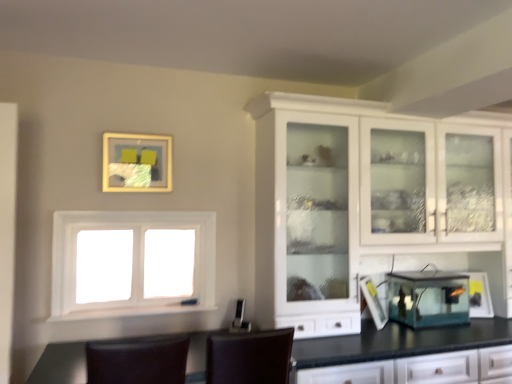
At what (x,y) coordinates should I click in order to perform the action: click on free space below white matte window at center (from a real-world perspective). Please return your answer as a coordinate pair (x, y). The width and height of the screenshot is (512, 384). Looking at the image, I should click on (138, 313).